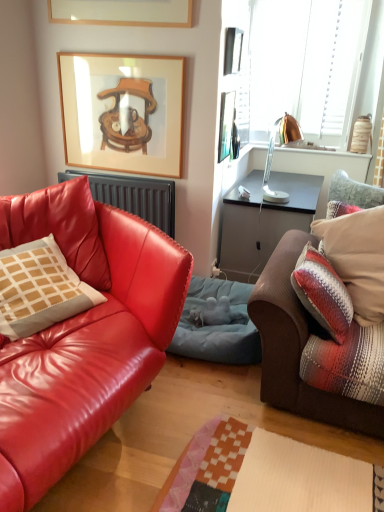
Locate an element on the screen. The height and width of the screenshot is (512, 384). free point above wooden picture frame at upper center, which ranks as the 1th picture frame in left-to-right order (from a real-world perspective) is located at coordinates (126, 51).